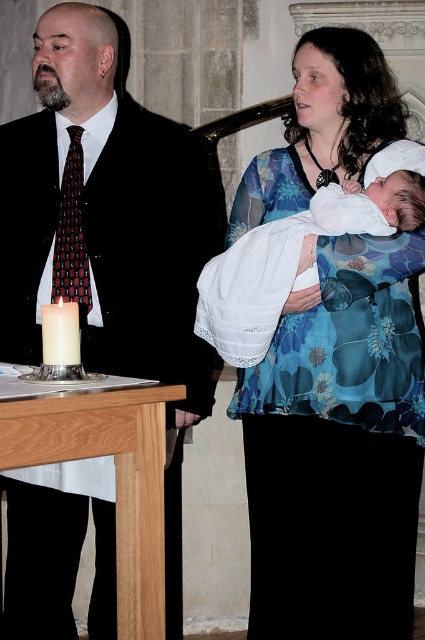
Question: Among these objects, which one is farthest from the camera?

Choices:
 (A) white wax candle at lower left
 (B) matte black suit at left
 (C) blue floral dress at center

Answer: (B)

Question: Which object appears farthest from the camera in this image?

Choices:
 (A) white wax candle at lower left
 (B) dark red textured tie at left
 (C) matte black suit at left

Answer: (B)

Question: Is the position of white lace cloth at center less distant than that of dark red textured tie at left?

Choices:
 (A) no
 (B) yes

Answer: (B)

Question: Does blue floral dress at center appear over white lace cloth at center?

Choices:
 (A) no
 (B) yes

Answer: (A)

Question: Which object is positioned closest to the white wax candle at lower left?

Choices:
 (A) white lace cloth at center
 (B) dark red textured tie at left
 (C) matte black suit at left

Answer: (B)

Question: Is white lace cloth at center to the left of dark red textured tie at left from the viewer's perspective?

Choices:
 (A) yes
 (B) no

Answer: (B)